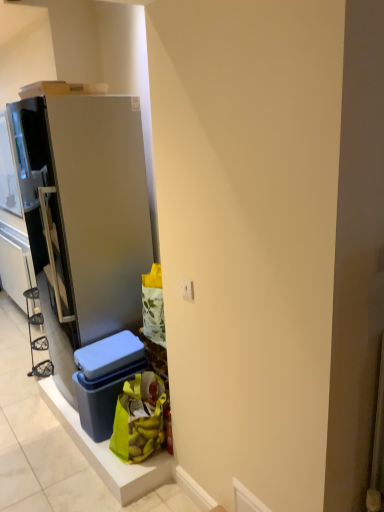
Question: From the image's perspective, is white plastic electric outlet at center on satin silver refrigerator at left?

Choices:
 (A) yes
 (B) no

Answer: (B)

Question: Is white plastic electric outlet at center not near satin silver refrigerator at left?

Choices:
 (A) no
 (B) yes

Answer: (A)

Question: Is white plastic electric outlet at center to the left of satin silver refrigerator at left from the viewer's perspective?

Choices:
 (A) no
 (B) yes

Answer: (A)

Question: From the image's perspective, would you say white plastic electric outlet at center is shown under satin silver refrigerator at left?

Choices:
 (A) yes
 (B) no

Answer: (A)

Question: From a real-world perspective, is white plastic electric outlet at center under satin silver refrigerator at left?

Choices:
 (A) yes
 (B) no

Answer: (B)

Question: Is white plastic electric outlet at center in contact with satin silver refrigerator at left?

Choices:
 (A) no
 (B) yes

Answer: (A)

Question: Is matte blue plastic storage box at lower center oriented towards green fabric bag at lower center?

Choices:
 (A) yes
 (B) no

Answer: (B)

Question: Is matte blue plastic storage box at lower center shorter than green fabric bag at lower center?

Choices:
 (A) yes
 (B) no

Answer: (B)

Question: Is matte blue plastic storage box at lower center next to green fabric bag at lower center and touching it?

Choices:
 (A) no
 (B) yes

Answer: (A)

Question: Is the position of matte blue plastic storage box at lower center more distant than that of green fabric bag at lower center?

Choices:
 (A) yes
 (B) no

Answer: (A)

Question: Considering the relative sizes of matte blue plastic storage box at lower center and green fabric bag at lower center in the image provided, is matte blue plastic storage box at lower center wider than green fabric bag at lower center?

Choices:
 (A) no
 (B) yes

Answer: (B)

Question: From a real-world perspective, is matte blue plastic storage box at lower center physically above green fabric bag at lower center?

Choices:
 (A) yes
 (B) no

Answer: (A)

Question: Does satin silver refrigerator at left appear on the left side of matte blue plastic storage box at lower center?

Choices:
 (A) yes
 (B) no

Answer: (A)